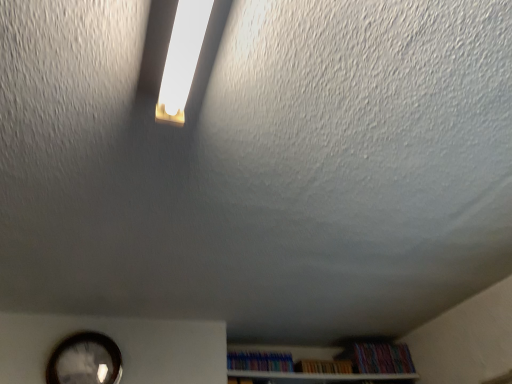
Question: Looking at their shapes, would you say multicolored paperbacks at lower right, positioned as the 1th book in right-to-left order, is wider or thinner than white wooden shelf at lower center?

Choices:
 (A) thin
 (B) wide

Answer: (A)

Question: In terms of size, does multicolored paperbacks at lower right, positioned as the 1th book in right-to-left order, appear bigger or smaller than white wooden shelf at lower center?

Choices:
 (A) big
 (B) small

Answer: (B)

Question: Which of these objects is positioned closest to the white wooden shelf at lower center?

Choices:
 (A) wooden bookshelf at lower center, marked as the second book in a left-to-right arrangement
 (B) multicolored paperbacks at lower right, which appears as the 3th book when viewed from the left
 (C) multicolored plastic books at lower center, the 1th book from the left
 (D) matte black clock at lower left

Answer: (C)

Question: Estimate the real-world distances between objects in this image. Which object is farther from the white wooden shelf at lower center?

Choices:
 (A) wooden bookshelf at lower center, marked as the 2th book in a right-to-left arrangement
 (B) matte black clock at lower left
 (C) multicolored plastic books at lower center, arranged as the third book when viewed from the right
 (D) multicolored paperbacks at lower right, positioned as the 1th book in right-to-left order

Answer: (B)